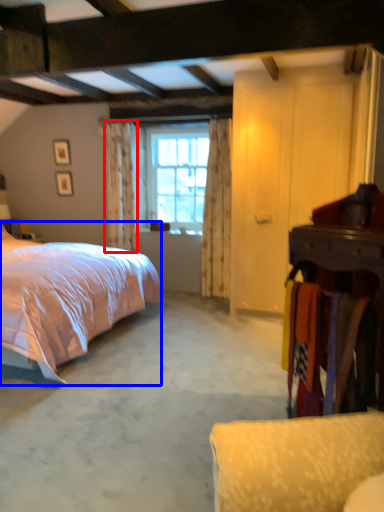
Question: Which object appears closest to the camera in this image, curtain (highlighted by a red box) or bed (highlighted by a blue box)?

Choices:
 (A) curtain
 (B) bed

Answer: (B)